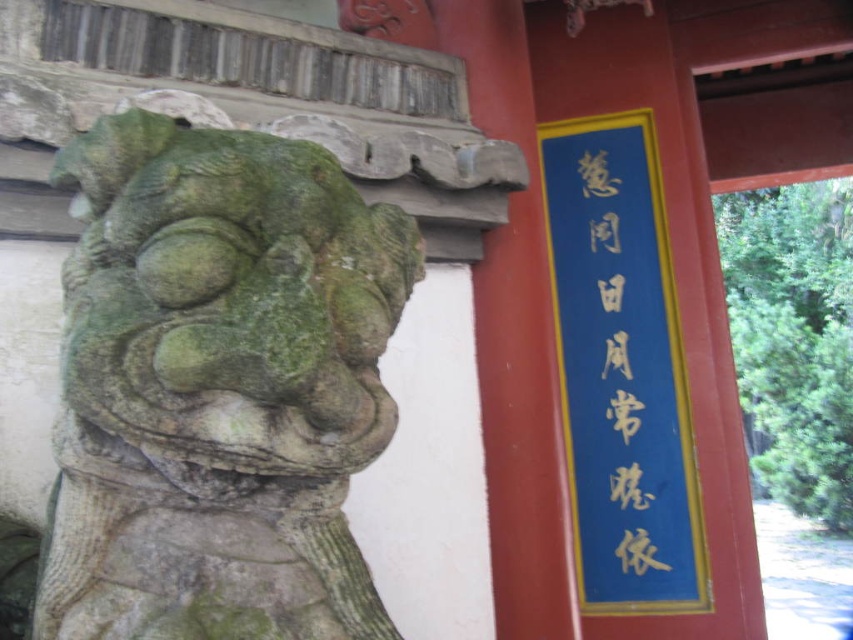
Is green stone lion at left further to camera compared to blue paper sign at upper right?

No, it is in front of blue paper sign at upper right.

This screenshot has width=853, height=640. What do you see at coordinates (218, 387) in the screenshot? I see `green stone lion at left` at bounding box center [218, 387].

You are a GUI agent. You are given a task and a screenshot of the screen. Output one action in this format:
    pyautogui.click(x=<x>, y=<y>)
    Task: Click on the green stone lion at left
    
    Given the screenshot: What is the action you would take?
    pyautogui.click(x=218, y=387)